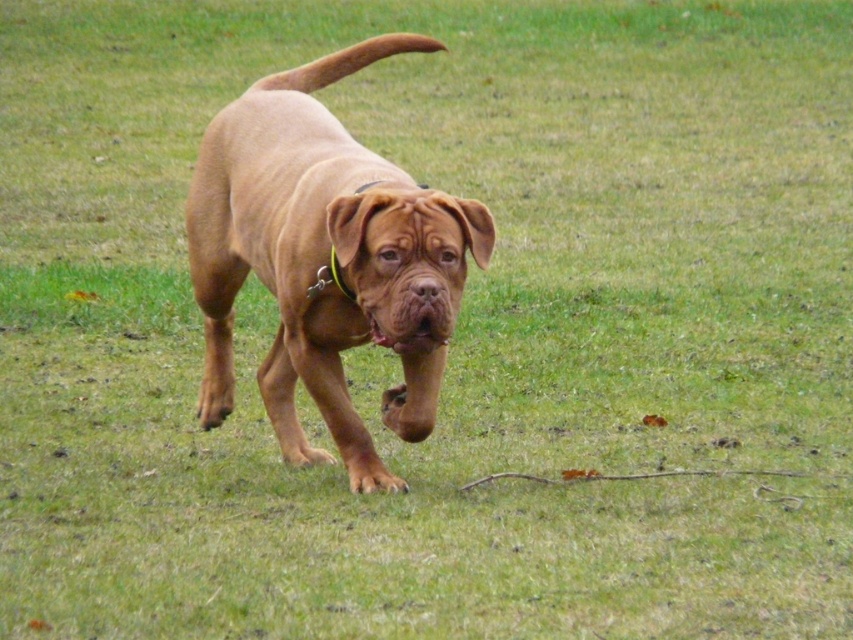
You are a photographer trying to capture the perfect shot of the dog in the grassy field. The dog is currently at point (325,259). If you want to position your camera exactly where the dog is standing, what coordinates should you aim for?

The smooth brown dog at center is located at point (325,259), so you should aim for coordinates (325,259).

You are a dog trainer observing the smooth brown dog at center and its green fabric collar at center. Based on their sizes, can you determine if the collar is properly fitted?

The smooth brown dog at center is wider than the green fabric collar at center, so the collar is too small and needs to be adjusted or replaced to ensure a proper fit.